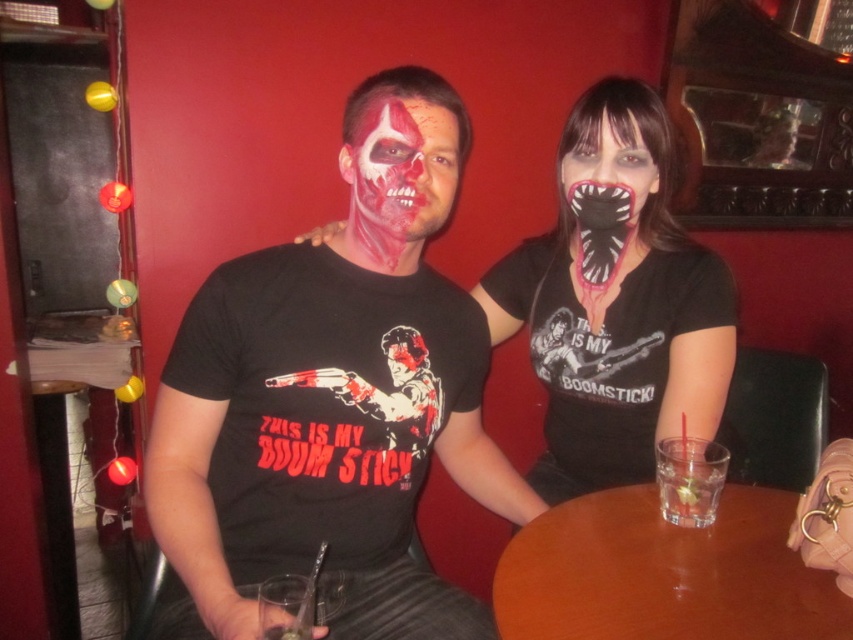
Question: Does brown wooden table at center have a greater width compared to black matte mask at center?

Choices:
 (A) yes
 (B) no

Answer: (A)

Question: Which object appears farthest from the camera in this image?

Choices:
 (A) matte black mask at center
 (B) black matte mask at center
 (C) brown wooden table at center

Answer: (B)

Question: Is matte black mask at center above brown wooden table at center?

Choices:
 (A) no
 (B) yes

Answer: (B)

Question: Which point is closer to the camera?

Choices:
 (A) matte black mask at center
 (B) brown wooden table at center
 (C) matte red face paint at center
 (D) black matte mask at center

Answer: (B)

Question: Does brown wooden table at center come behind matte red face paint at center?

Choices:
 (A) yes
 (B) no

Answer: (B)

Question: Which object is farther from the camera taking this photo?

Choices:
 (A) matte red face paint at center
 (B) black matte mask at center

Answer: (B)